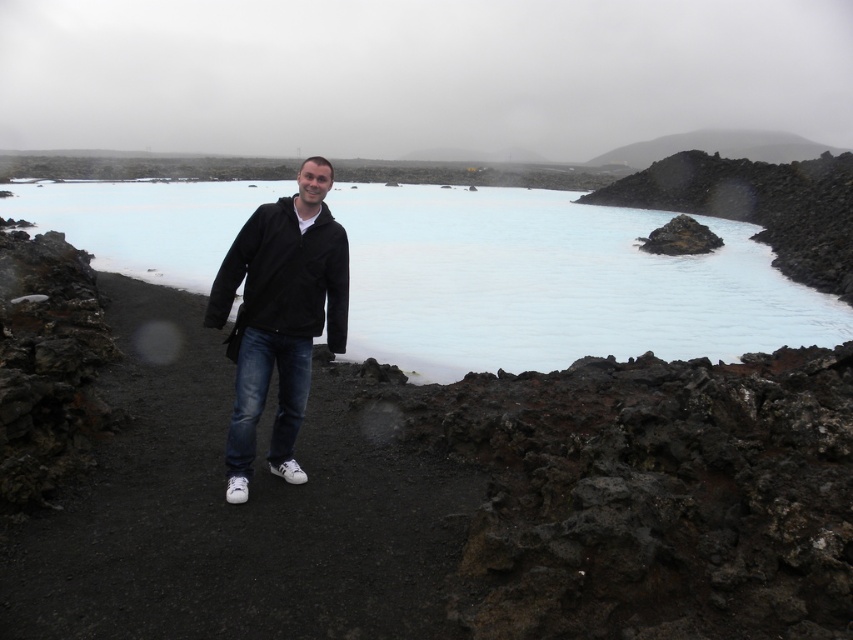
You are a photographer trying to capture the reflection of the black matte jacket at center in the blue smooth water at center. Based on the scene, can you confirm if the reflection will be visible?

The blue smooth water at center is above the black matte jacket at center, so the reflection of the black matte jacket at center would not be visible in the water since the jacket is positioned above the water surface.